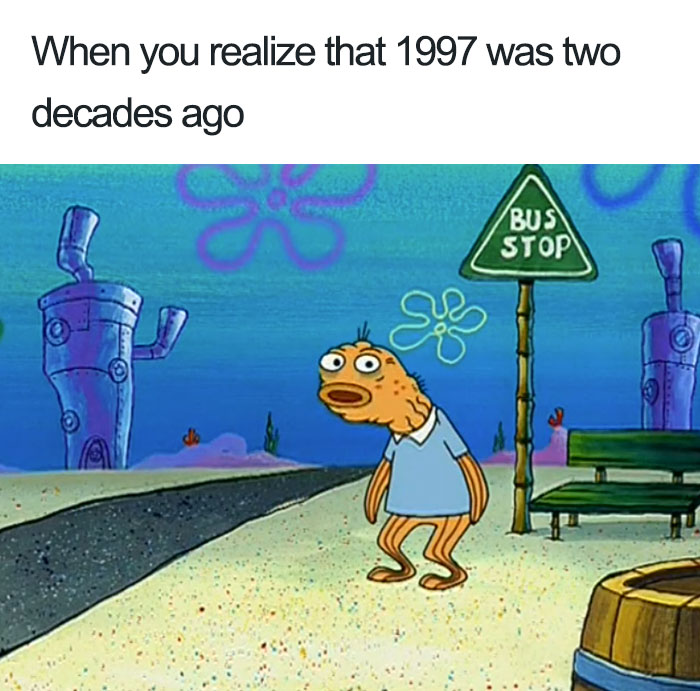
Identify the location of window frame. The width and height of the screenshot is (700, 691). (678, 345).